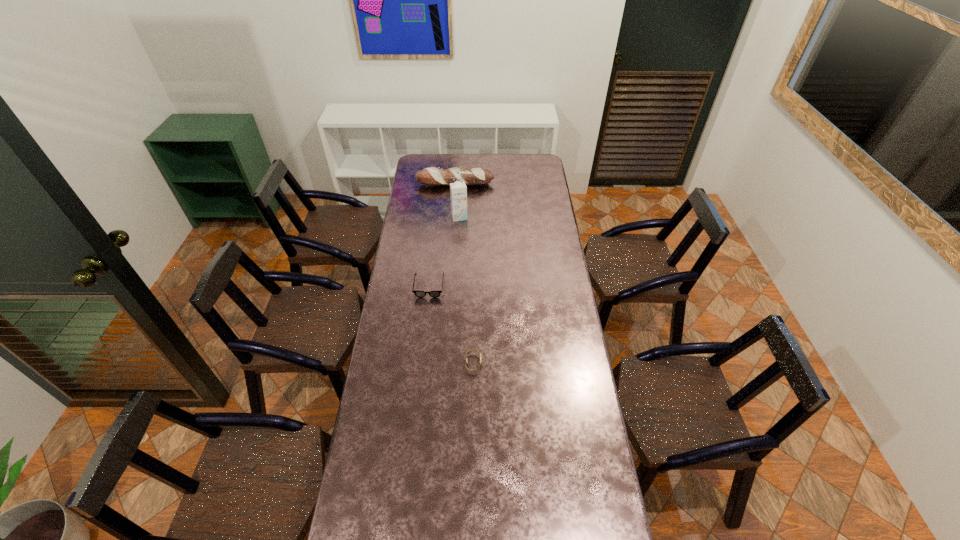
The width and height of the screenshot is (960, 540). Identify the location of the tallest object. (458, 191).

The image size is (960, 540). In order to click on the second farthest object in this screenshot , I will do `click(458, 191)`.

You are a GUI agent. You are given a task and a screenshot of the screen. Output one action in this format:
    pyautogui.click(x=<x>, y=<y>)
    Task: Click on the second tallest object
    The width and height of the screenshot is (960, 540).
    Given the screenshot: What is the action you would take?
    pyautogui.click(x=436, y=176)

Find the location of `baguet`. baguet is located at coordinates (436, 176).

I want to click on spectacles, so click(420, 294).

You are a GUI agent. You are given a task and a screenshot of the screen. Output one action in this format:
    pyautogui.click(x=<x>, y=<y>)
    Task: Click on the shortest object
    This screenshot has height=540, width=960.
    Given the screenshot: What is the action you would take?
    pyautogui.click(x=469, y=351)

Locate an element on the screen. The height and width of the screenshot is (540, 960). the nearest object is located at coordinates (469, 351).

Where is `vacant area located 0.280m on the right of the third nearest object`? This screenshot has height=540, width=960. vacant area located 0.280m on the right of the third nearest object is located at coordinates (518, 217).

This screenshot has width=960, height=540. In order to click on vacant space located 0.210m on the right of the farthest object in this screenshot , I will do `click(530, 184)`.

Where is `vacant space located 0.380m on the arms of the spectacles`? Image resolution: width=960 pixels, height=540 pixels. vacant space located 0.380m on the arms of the spectacles is located at coordinates (420, 370).